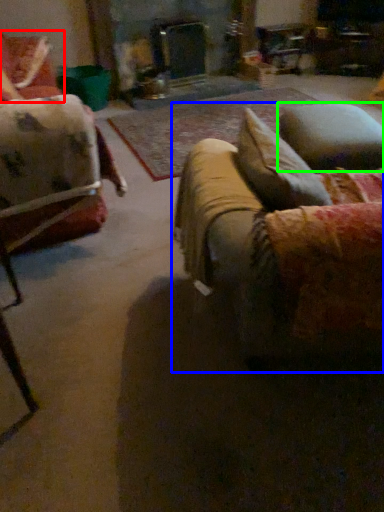
Question: Which object is positioned farthest from chair (highlighted by a red box)? Select from studio couch (highlighted by a blue box) and pillow (highlighted by a green box).

Choices:
 (A) studio couch
 (B) pillow

Answer: (A)